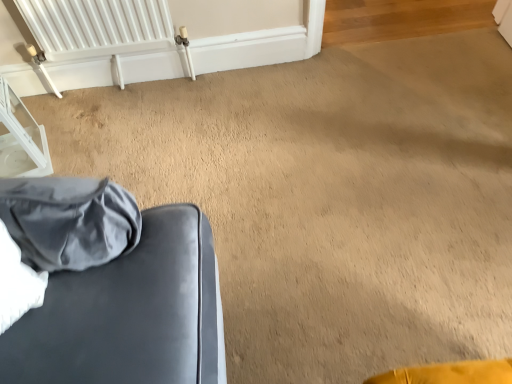
What do you see at coordinates (21, 139) in the screenshot? I see `white plastic drawer at left` at bounding box center [21, 139].

What is the approximate height of white plastic drawer at left?

white plastic drawer at left is 14.35 inches in height.

Locate an element on the screen. The height and width of the screenshot is (384, 512). white plastic drawer at left is located at coordinates (21, 139).

Where is `white plastic drawer at left`? The width and height of the screenshot is (512, 384). white plastic drawer at left is located at coordinates (21, 139).